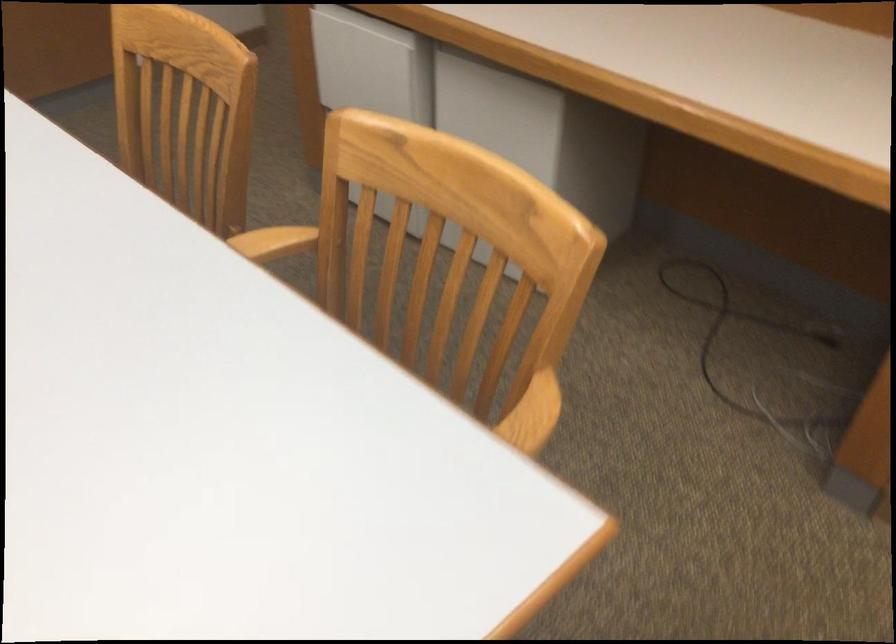
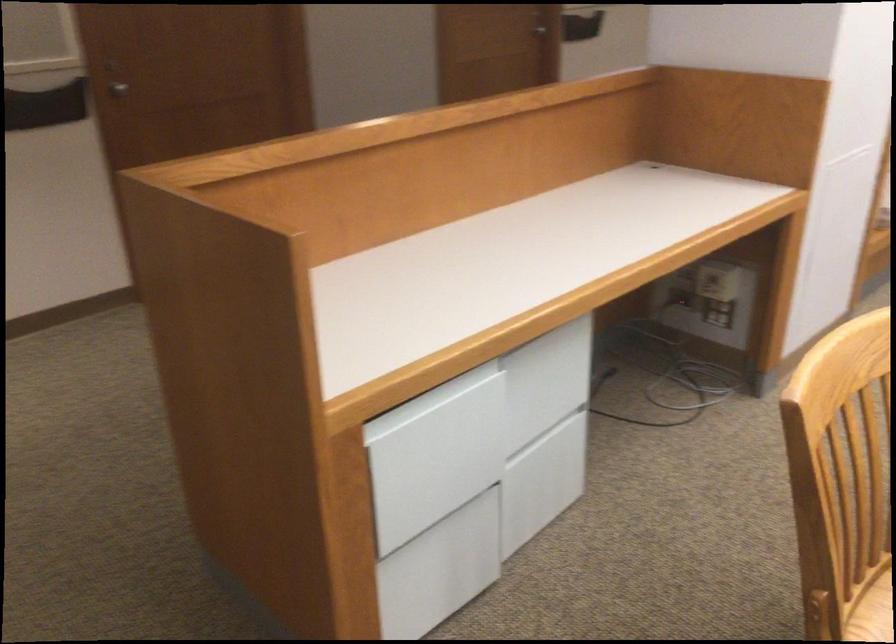
Find the pixel in the second image that matches [495,118] in the first image.

(547, 381)